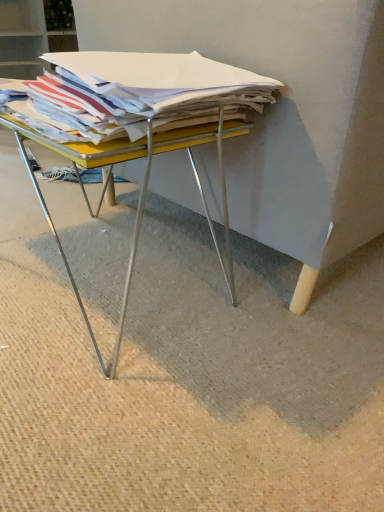
Question: From the image's perspective, is yellow metal desk at center above or below white paper stack at center?

Choices:
 (A) above
 (B) below

Answer: (B)

Question: Relative to white paper stack at center, is yellow metal desk at center in front or behind?

Choices:
 (A) behind
 (B) front

Answer: (A)

Question: Would you say yellow metal desk at center is to the left or to the right of white paper stack at center in the picture?

Choices:
 (A) left
 (B) right

Answer: (A)

Question: Would you say white paper stack at center is to the left or to the right of yellow metal desk at center in the picture?

Choices:
 (A) left
 (B) right

Answer: (B)

Question: Is white paper stack at center wider or thinner than yellow metal desk at center?

Choices:
 (A) thin
 (B) wide

Answer: (A)

Question: Is white paper stack at center in front of or behind yellow metal desk at center in the image?

Choices:
 (A) front
 (B) behind

Answer: (A)

Question: Does point (29, 98) appear closer or farther from the camera than point (238, 120)?

Choices:
 (A) closer
 (B) farther

Answer: (A)